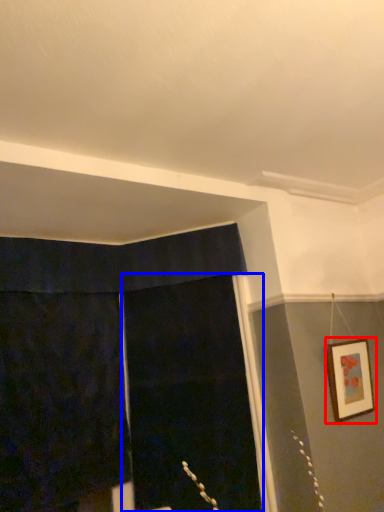
Question: Among these objects, which one is nearest to the camera, picture frame (highlighted by a red box) or screen door (highlighted by a blue box)?

Choices:
 (A) picture frame
 (B) screen door

Answer: (A)